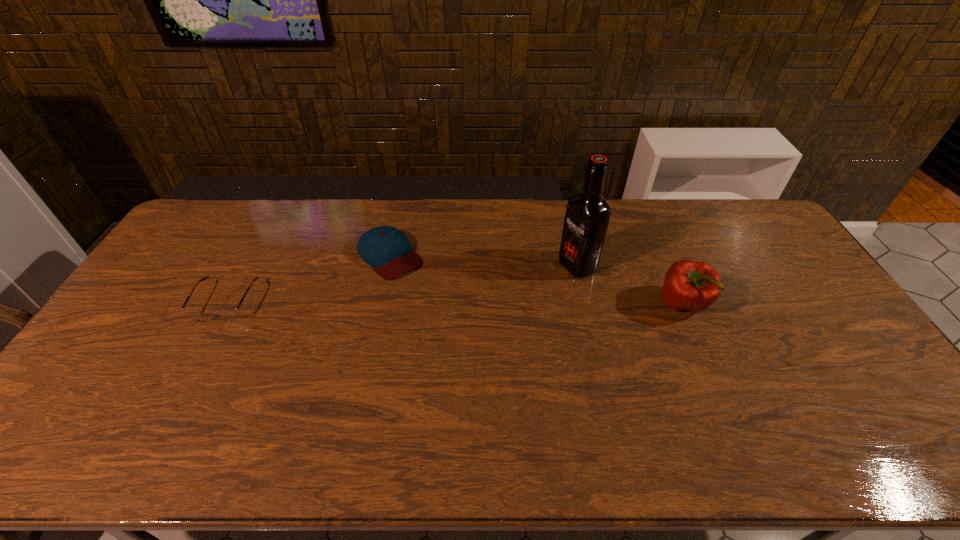
At what (x,y) coordinates should I click in order to perform the action: click on free spot on the desktop that is between the spectacles and the third shortest object and is positioned on the front-facing side of the liquor. Please return your answer as a coordinate pair (x, y). Looking at the image, I should click on (500, 303).

Locate an element on the screen. This screenshot has height=540, width=960. vacant space on the desktop that is between the spectacles and the rightmost object and is positioned with the bill of the second shortest object facing forward is located at coordinates (435, 302).